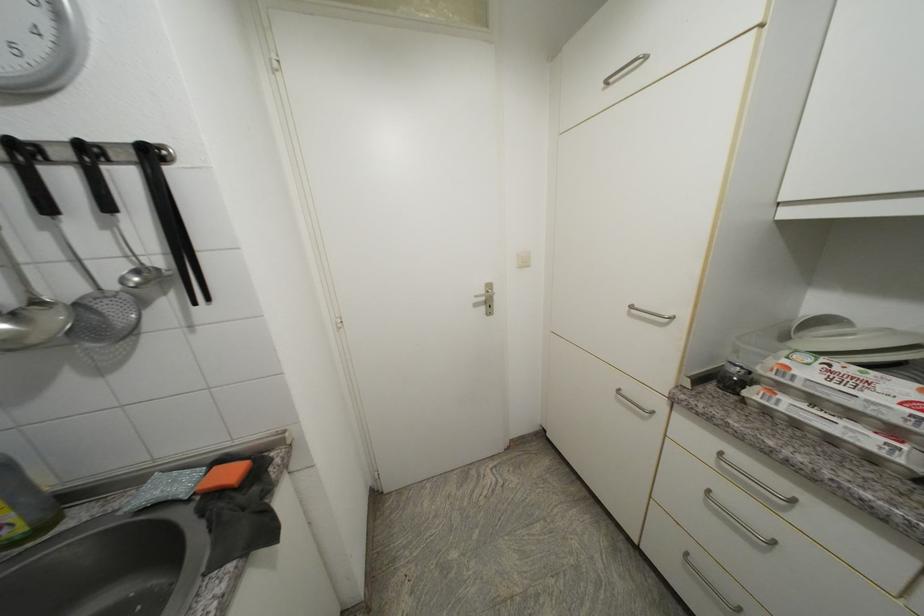
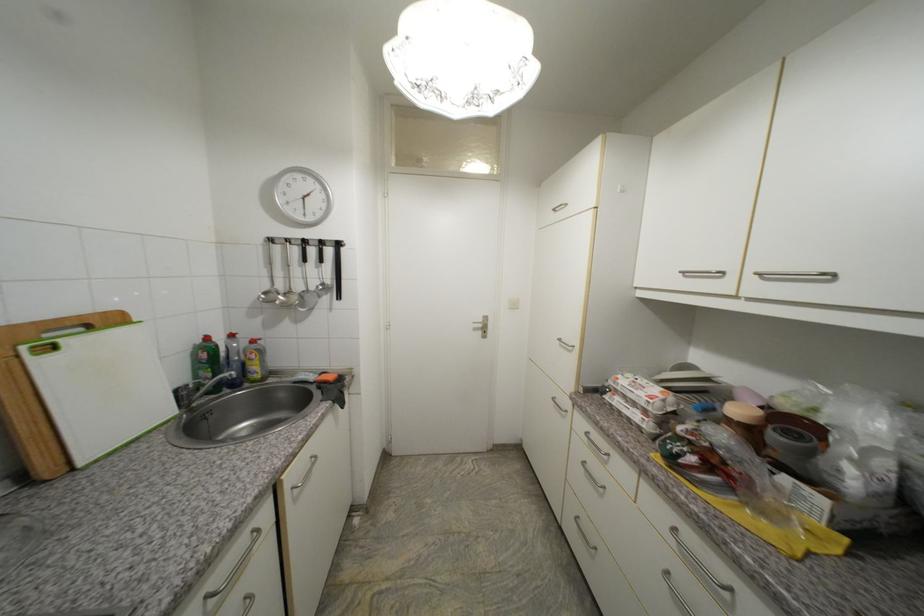
Find the pixel in the second image that matches point (795, 370) in the first image.

(623, 379)